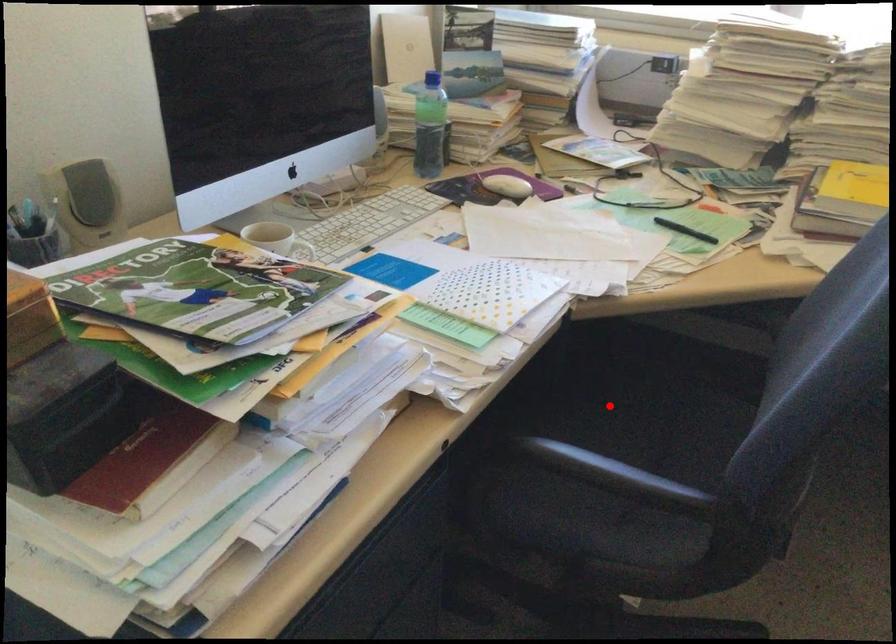
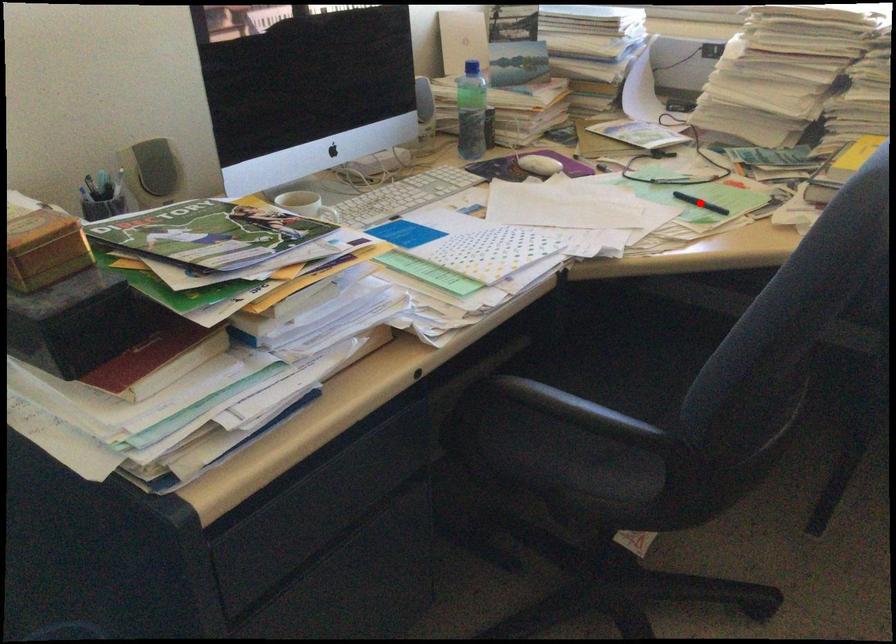
I am providing you with two images of the same scene from different viewpoints. A red point is marked on the first image and another point is marked on the second image. Is the marked point in image1 the same physical position as the marked point in image2?

No